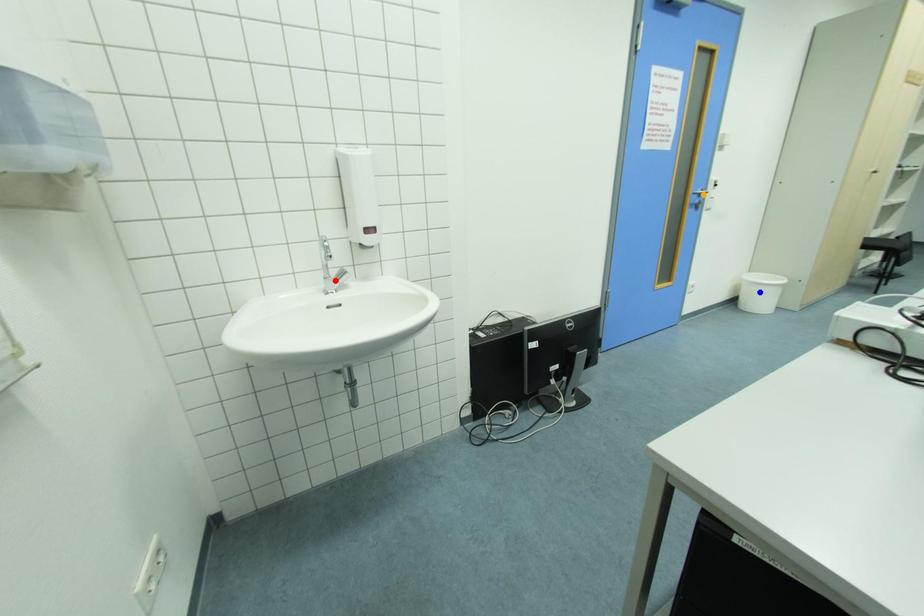
Consider the image. Order these from nearest to farthest:
A) red point
B) blue point
C) orange point

blue point < orange point < red point